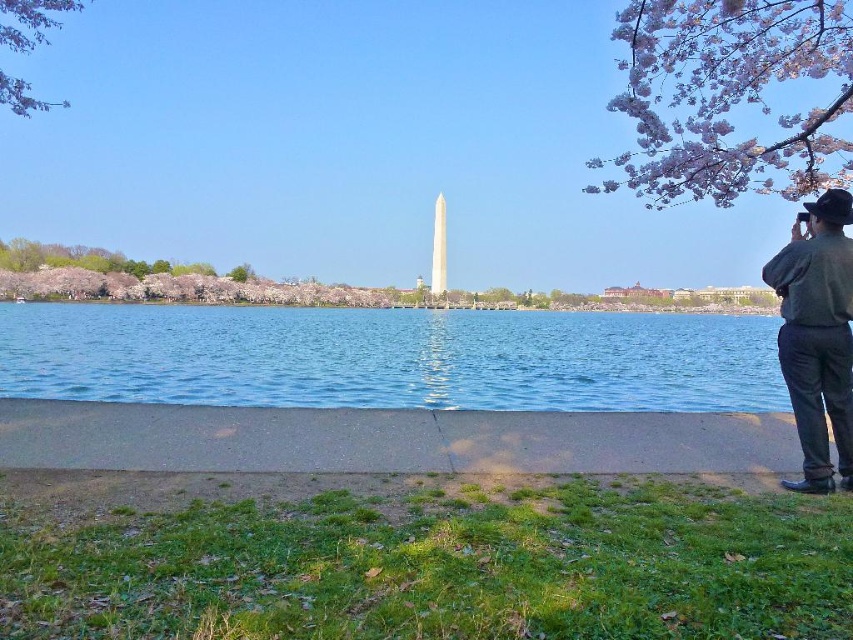
Question: Which point is closer to the camera?

Choices:
 (A) coord(33,20)
 (B) coord(849,358)
 (C) coord(531,390)

Answer: (B)

Question: Is clear blue water at center above dark green shirt at right?

Choices:
 (A) no
 (B) yes

Answer: (B)

Question: Is dark green shirt at right further to the viewer compared to green leafy tree at upper left?

Choices:
 (A) no
 (B) yes

Answer: (A)

Question: Which object appears closest to the camera in this image?

Choices:
 (A) peachy blossom branch at upper right
 (B) dark green shirt at right

Answer: (B)

Question: Can you confirm if dark green shirt at right is positioned above green leafy tree at center?

Choices:
 (A) no
 (B) yes

Answer: (A)

Question: Which object is closer to the camera taking this photo?

Choices:
 (A) peachy blossom branch at upper right
 (B) clear blue water at center
 (C) green leafy tree at center

Answer: (B)